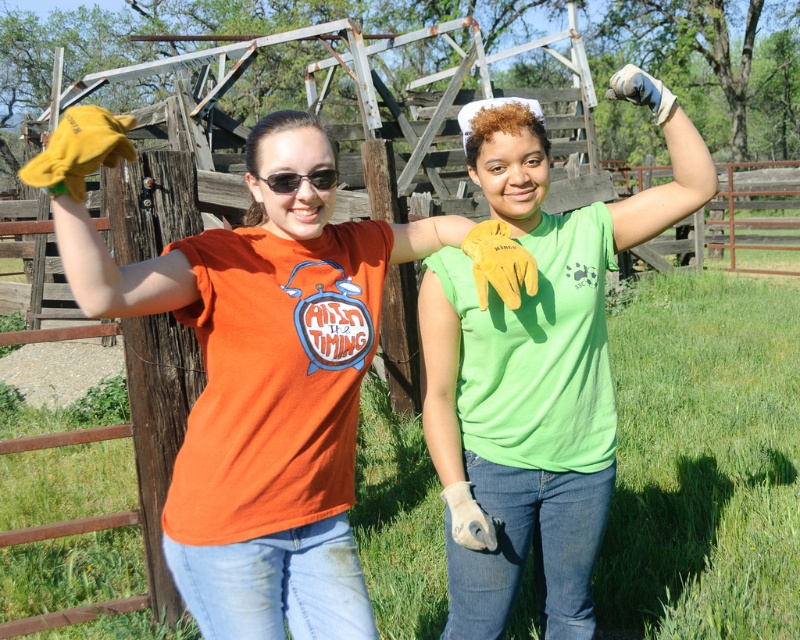
Does tan leather glove at center lie behind light brown leather glove at lower center?

No, it is not.

Is tan leather glove at center bigger than light brown leather glove at lower center?

Correct, tan leather glove at center is larger in size than light brown leather glove at lower center.

Identify the location of tan leather glove at center. The height and width of the screenshot is (640, 800). (448, 413).

Is point (632, 216) positioned in front of point (518, 262)?

That is False.

Measure the distance from yellow fabric glove at upper right to yellow leather glove at center.

They are 18.13 inches apart.

Is point (642, 84) positioned in front of point (524, 262)?

No, it is behind (524, 262).

Identify the location of yellow fabric glove at upper right. (670, 163).

Can you confirm if green matte shirt at upper center is taller than light brown leather glove at lower center?

Correct, green matte shirt at upper center is much taller as light brown leather glove at lower center.

Between point (513, 563) and point (494, 525), which one is positioned in front?

Point (494, 525) is in front.

Is point (454, 588) positioned in front of point (496, 520)?

No, (454, 588) is further to viewer.

Locate an element on the screen. The height and width of the screenshot is (640, 800). green matte shirt at upper center is located at coordinates (538, 368).